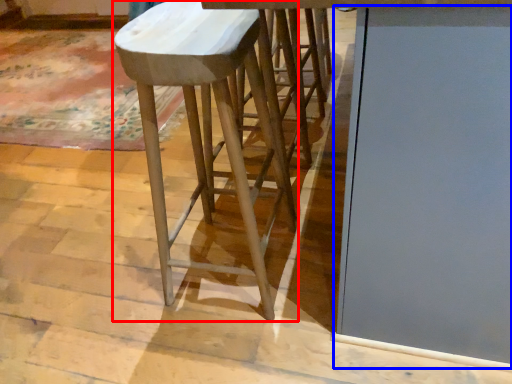
Question: Which object appears farthest to the camera in this image, stool (highlighted by a red box) or glass door (highlighted by a blue box)?

Choices:
 (A) stool
 (B) glass door

Answer: (A)